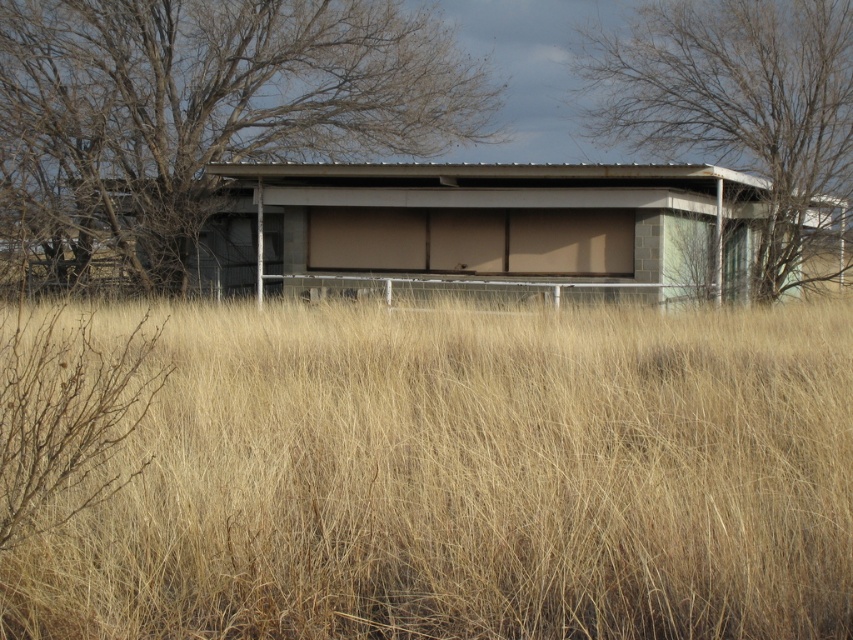
Between dry grass at center and bare branches at upper center, which one is positioned lower?

dry grass at center

Is dry grass at center below bare branches at upper center?

Yes.

Is point (668, 317) farther from camera compared to point (703, 33)?

No, it is not.

This screenshot has height=640, width=853. In order to click on dry grass at center in this screenshot , I will do `click(469, 480)`.

At what (x,y) coordinates should I click in order to perform the action: click on dry grass at center. Please return your answer as a coordinate pair (x, y). This screenshot has width=853, height=640. Looking at the image, I should click on (469, 480).

Is dry grass at center thinner than gray concrete hut at center?

Yes, dry grass at center is thinner than gray concrete hut at center.

Between point (186, 477) and point (741, 298), which one is positioned behind?

Positioned behind is point (741, 298).

Locate an element on the screen. This screenshot has height=640, width=853. dry grass at center is located at coordinates (469, 480).

Does bare branches at center appear under bare branches at upper center?

Yes, bare branches at center is below bare branches at upper center.

Can you confirm if bare branches at center is thinner than bare branches at upper center?

In fact, bare branches at center might be wider than bare branches at upper center.

Which is behind, point (283, 16) or point (694, 93)?

The point (694, 93) is behind.

Find the location of a particular element. The image size is (853, 640). bare branches at center is located at coordinates (206, 108).